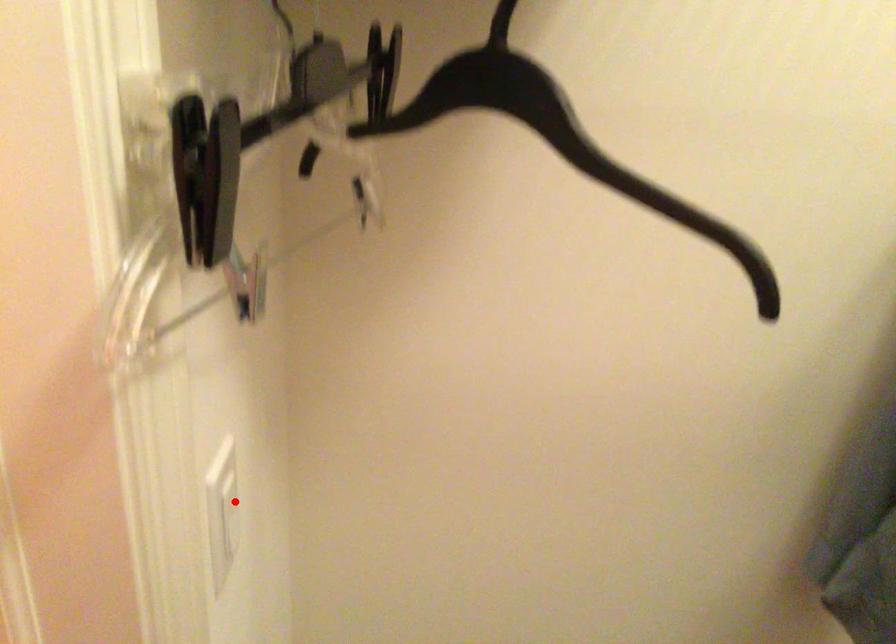
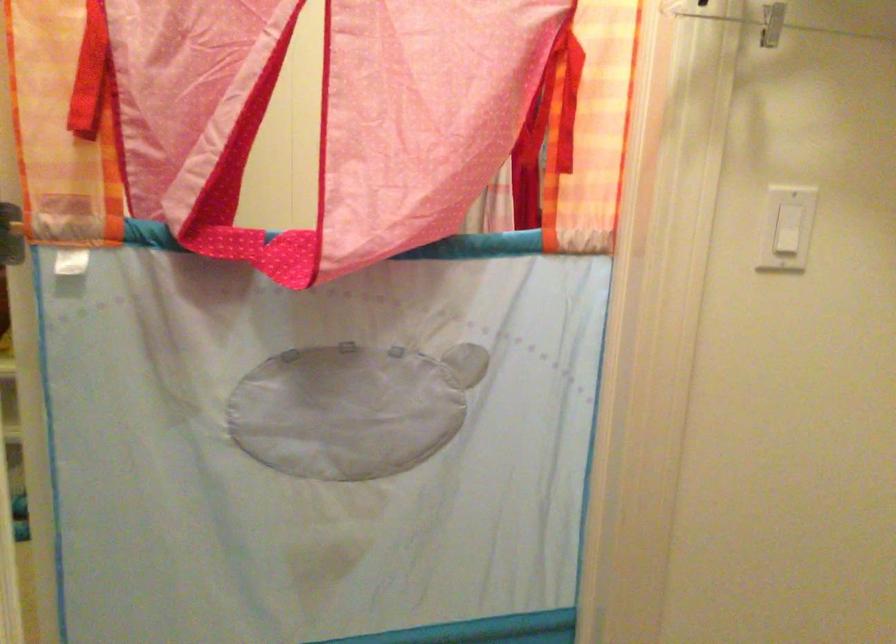
The point at the highlighted location is marked in the first image. Where is the corresponding point in the second image?

(786, 228)